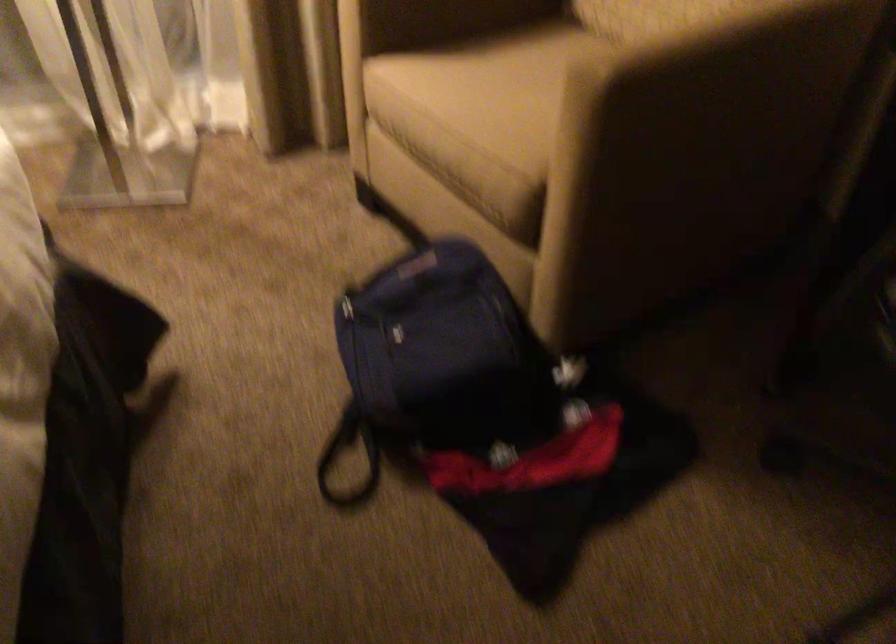
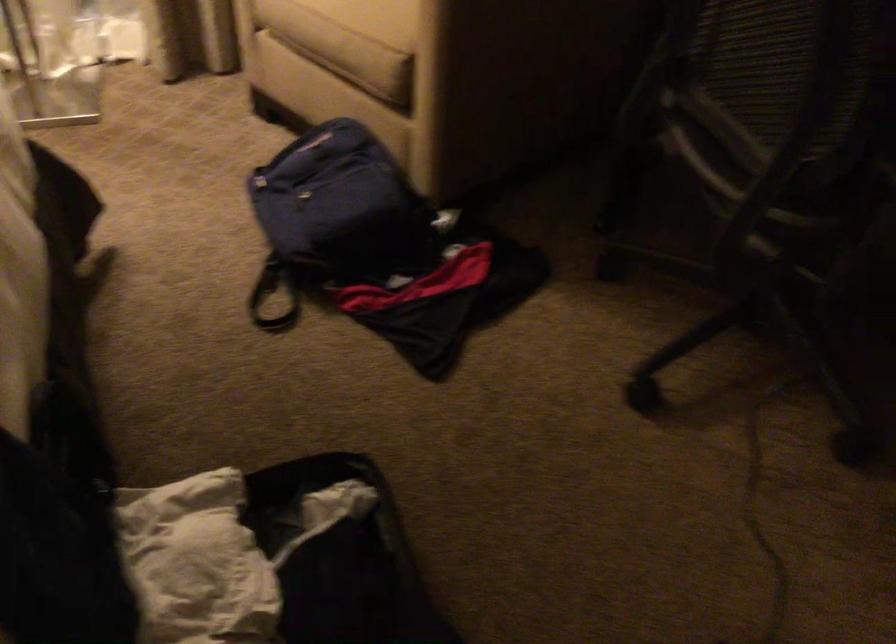
Locate, in the second image, the point that corresponds to [339,462] in the first image.

(263, 297)